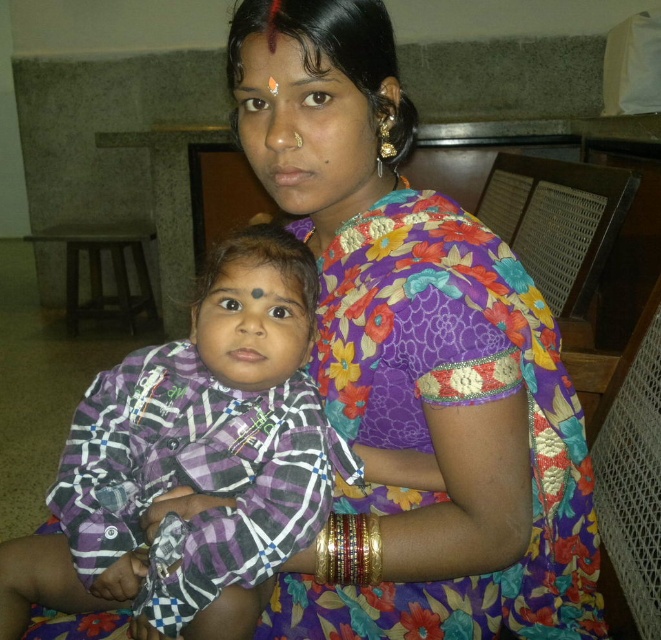
You are an observer looking at the scene. You notice the purple checkered shirt at center and the matte black forehead at upper center. Which object is positioned to the left of the other?

The purple checkered shirt at center is to the left of matte black forehead at upper center.

You are a photographer trying to capture a closeup shot of the floral silk saree at center and the matte black forehead at upper center in the image. Can you fit both subjects into your camera frame if the maximum distance your camera can handle for a clear closeup is 12 inches?

The floral silk saree at center is 12.19 inches away from the matte black forehead at upper center, which exceeds the camera frame limit of 12 inches. Therefore, you cannot fit both subjects into the frame clearly.

You are a tailor measuring the distance between the purple checkered shirt at center and the matte black forehead at upper center for a custom fitting. The minimum required space for proper stitching is 16 inches. Is the current distance sufficient?

The distance between the purple checkered shirt at center and the matte black forehead at upper center is 15.38 inches, which is less than the required 16 inches. Therefore, the current distance is insufficient for proper stitching.